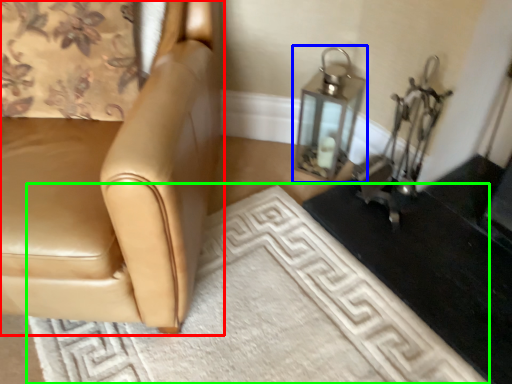
Question: Which is nearer to the chair (highlighted by a red box)? oil lamp (highlighted by a blue box) or doormat (highlighted by a green box).

Choices:
 (A) oil lamp
 (B) doormat

Answer: (B)